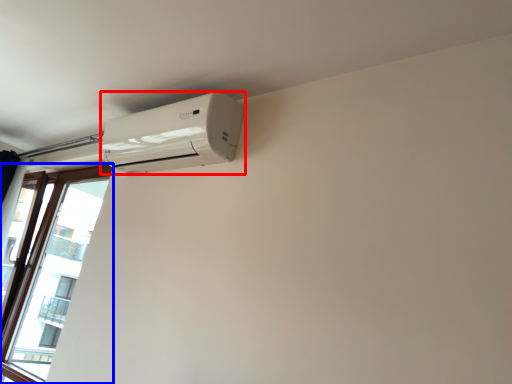
Question: Which point is closer to the camera, home appliance (highlighted by a red box) or window (highlighted by a blue box)?

Choices:
 (A) home appliance
 (B) window

Answer: (A)